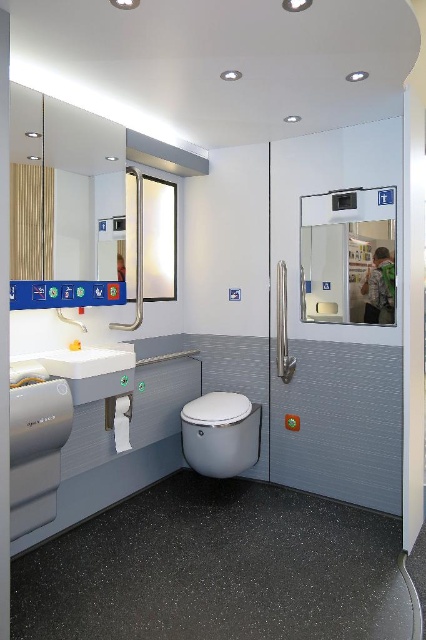
You are standing in the bathroom and want to hang a new shelf above the sink. The shelf requires mounting brackets at coordinates between 0.2 and 0.3 on the horizontal axis and between 0.1 and 0.2 on the vertical axis. Will the matte glass mirror at upper center interfere with the shelf installation?

The matte glass mirror at upper center is located at point 0.273 on the horizontal axis and 0.120 on the vertical axis, which falls within the specified coordinates for the shelf brackets. Therefore, installing the shelf may interfere with the mirror.

You are standing in the bathroom and want to locate the point at coordinates (x=348, y=257). According to the scene description, where would this point be located?

The point at coordinates (x=348, y=257) is located on the clear glass mirror at center.